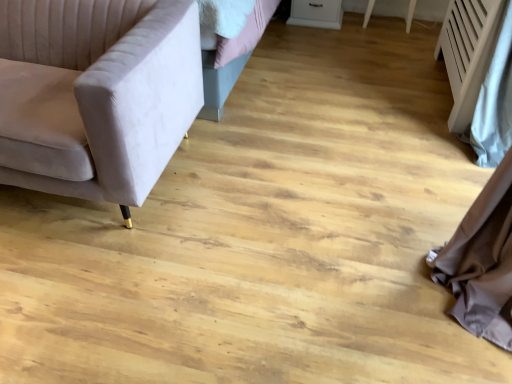
What do you see at coordinates (468, 52) in the screenshot?
I see `white textured radiator at right` at bounding box center [468, 52].

The height and width of the screenshot is (384, 512). What are the coordinates of `velvet beige couch at left` in the screenshot? It's located at (96, 94).

Does velvet beige couch at left have a greater width compared to white textured radiator at right?

Yes, velvet beige couch at left is wider than white textured radiator at right.

Is velvet beige couch at left to the left of white textured radiator at right from the viewer's perspective?

Correct, you'll find velvet beige couch at left to the left of white textured radiator at right.

From a real-world perspective, who is located higher, velvet beige couch at left or white textured radiator at right?

white textured radiator at right, from a real-world perspective.

Image resolution: width=512 pixels, height=384 pixels. I want to click on radiator on the right of velvet beige couch at left, so click(x=468, y=52).

Does white glossy drawer at upper center have a smaller size compared to velvet beige couch at left?

Yes.

Is point (319, 12) closer to camera compared to point (104, 132)?

No, it is behind (104, 132).

Considering the sizes of objects white glossy drawer at upper center and velvet beige couch at left in the image provided, who is shorter, white glossy drawer at upper center or velvet beige couch at left?

Standing shorter between the two is white glossy drawer at upper center.

From a real-world perspective, does white glossy drawer at upper center sit lower than velvet beige couch at left?

Yes.

At what (x,y) coordinates should I click in order to perform the action: click on drawer on the left of white textured radiator at right. Please return your answer as a coordinate pair (x, y). The height and width of the screenshot is (384, 512). Looking at the image, I should click on (316, 10).

Can you confirm if white glossy drawer at upper center is smaller than white textured radiator at right?

Correct, white glossy drawer at upper center occupies less space than white textured radiator at right.

From a real-world perspective, does white glossy drawer at upper center sit lower than white textured radiator at right?

Yes, from a real-world perspective, white glossy drawer at upper center is under white textured radiator at right.

I want to click on drawer lying above the velvet beige couch at left (from the image's perspective), so coord(316,10).

Looking at this image, considering the relative sizes of velvet beige couch at left and white glossy drawer at upper center in the image provided, is velvet beige couch at left smaller than white glossy drawer at upper center?

No.

From a real-world perspective, is velvet beige couch at left positioned above or below white glossy drawer at upper center?

Clearly, from a real-world perspective, velvet beige couch at left is above white glossy drawer at upper center.

From a real-world perspective, which is physically above, white textured radiator at right or white glossy drawer at upper center?

In real-world perspective, white textured radiator at right is above.

Is white textured radiator at right wider than white glossy drawer at upper center?

Yes.

Based on the photo, is white textured radiator at right turned away from white glossy drawer at upper center?

white textured radiator at right does not have its back to white glossy drawer at upper center.

Between white textured radiator at right and velvet beige couch at left, which one appears on the left side from the viewer's perspective?

From the viewer's perspective, velvet beige couch at left appears more on the left side.

Which of these two, white textured radiator at right or velvet beige couch at left, stands taller?

Standing taller between the two is white textured radiator at right.

Is white textured radiator at right next to velvet beige couch at left and touching it?

white textured radiator at right is not next to velvet beige couch at left, and they're not touching.

Image resolution: width=512 pixels, height=384 pixels. What are the coordinates of `radiator located behind the velvet beige couch at left` in the screenshot? It's located at (468, 52).

Find the location of a particular element. The height and width of the screenshot is (384, 512). drawer to the right of velvet beige couch at left is located at coordinates (316, 10).

Consider the image. Based on their spatial positions, is velvet beige couch at left or white glossy drawer at upper center further from white textured radiator at right?

velvet beige couch at left is further to white textured radiator at right.

From the picture: Estimate the real-world distances between objects in this image. Which object is further from white glossy drawer at upper center, white textured radiator at right or velvet beige couch at left?

velvet beige couch at left.

Based on their spatial positions, is white textured radiator at right or white glossy drawer at upper center further from velvet beige couch at left?

The object further to velvet beige couch at left is white glossy drawer at upper center.

Looking at the image, which one is located closer to velvet beige couch at left, white glossy drawer at upper center or white textured radiator at right?

white textured radiator at right is closer to velvet beige couch at left.

Which object lies further to the anchor point white glossy drawer at upper center, velvet beige couch at left or white textured radiator at right?

velvet beige couch at left is further to white glossy drawer at upper center.

From the image, which object appears to be farther from white textured radiator at right, white glossy drawer at upper center or velvet beige couch at left?

velvet beige couch at left is positioned further to the anchor white textured radiator at right.

The image size is (512, 384). I want to click on drawer between velvet beige couch at left and white textured radiator at right in the horizontal direction, so click(x=316, y=10).